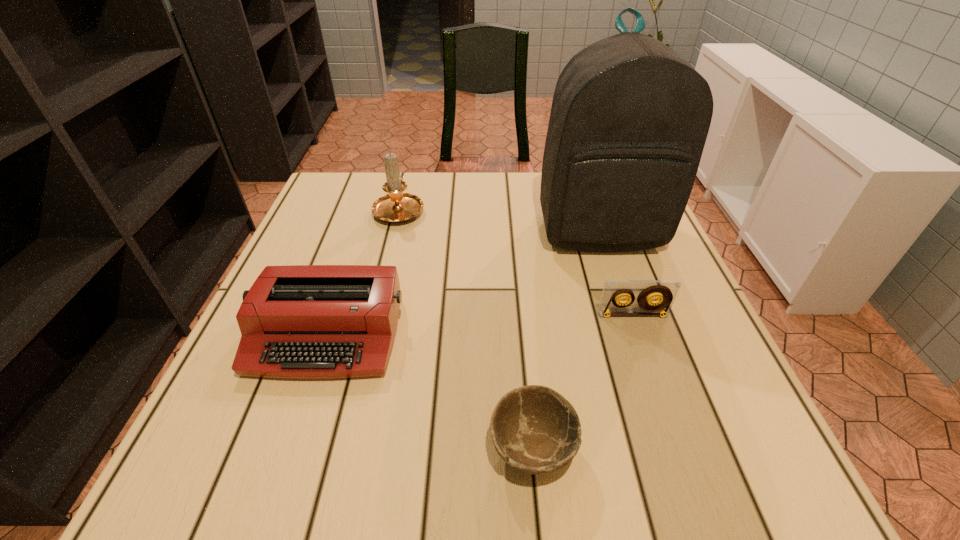
Where is `the tallest object`? the tallest object is located at coordinates (629, 119).

Locate an element on the screen. The image size is (960, 540). the second tallest object is located at coordinates (396, 206).

Where is `typewriter`? This screenshot has width=960, height=540. typewriter is located at coordinates (297, 321).

Where is `videotape`? This screenshot has height=540, width=960. videotape is located at coordinates (665, 291).

Where is `the nearest object`? Image resolution: width=960 pixels, height=540 pixels. the nearest object is located at coordinates (534, 429).

At what (x,y) coordinates should I click in order to perform the action: click on the third object from left to right. Please return your answer as a coordinate pair (x, y). Looking at the image, I should click on (534, 429).

Where is `free region located 0.270m on the front-facing side of the tallest object`? Image resolution: width=960 pixels, height=540 pixels. free region located 0.270m on the front-facing side of the tallest object is located at coordinates (642, 360).

Locate an element on the screen. The image size is (960, 540). vacant space situated 0.300m on the front of the fourth shortest object is located at coordinates (373, 318).

This screenshot has width=960, height=540. What are the coordinates of `vacant space situated 0.100m on the typing side of the typewriter` in the screenshot? It's located at (292, 438).

Identify the location of free location located 0.050m at the front of the videotape with visible reels. This screenshot has height=540, width=960. (640, 338).